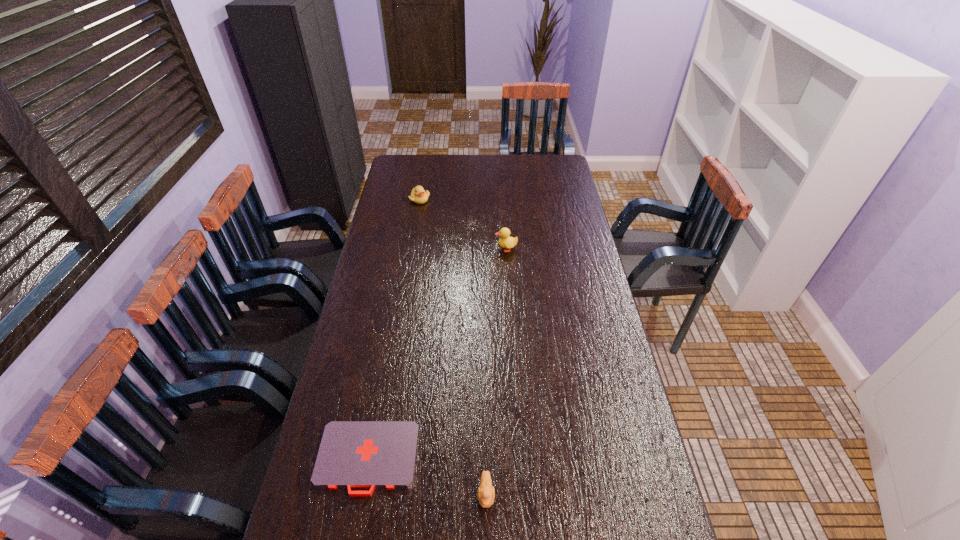
Image resolution: width=960 pixels, height=540 pixels. In order to click on vacant area between the rightmost duckling and the farthest duckling in this screenshot , I will do `click(463, 224)`.

I want to click on free space between the first-aid kit and the second duckling from right to left, so click(427, 476).

This screenshot has height=540, width=960. Find the location of `vacant area that lies between the farthest duckling and the second duckling from left to right`. vacant area that lies between the farthest duckling and the second duckling from left to right is located at coordinates (453, 347).

Locate an element on the screen. vacant space that's between the farthest duckling and the rightmost duckling is located at coordinates (463, 224).

Where is `free area in between the nearest duckling and the shortest object`? free area in between the nearest duckling and the shortest object is located at coordinates (427, 476).

The image size is (960, 540). In order to click on free space between the third object from left to right and the farthest object in this screenshot , I will do `click(453, 347)`.

Identify the location of vacant region between the second farthest duckling and the leftmost duckling. (463, 224).

Identify the location of free space between the farthest duckling and the rightmost object. The height and width of the screenshot is (540, 960). (463, 224).

Select which object is the second closest to the farthest object. Please provide its 2D coordinates. Your answer should be formatted as a tuple, i.e. [(x, y)], where the tuple contains the x and y coordinates of a point satisfying the conditions above.

[(372, 454)]

I want to click on the third closest object to the shortest duckling, so click(x=418, y=195).